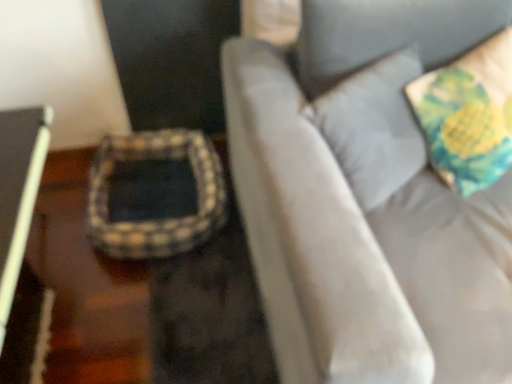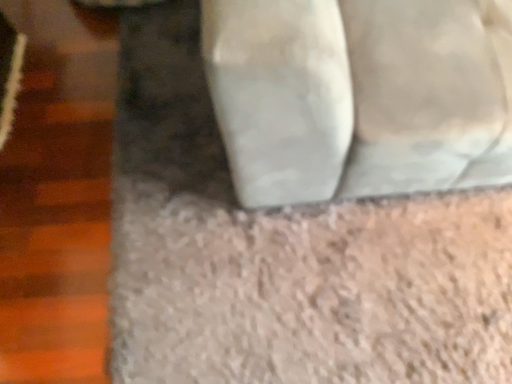
Question: Which way did the camera rotate in the video?

Choices:
 (A) rotated right
 (B) rotated left

Answer: (B)